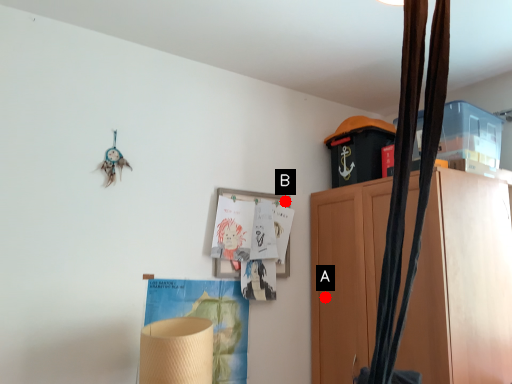
Question: Two points are circled on the image, labeled by A and B beside each circle. Which point is closer to the camera?

Choices:
 (A) A is closer
 (B) B is closer

Answer: (A)